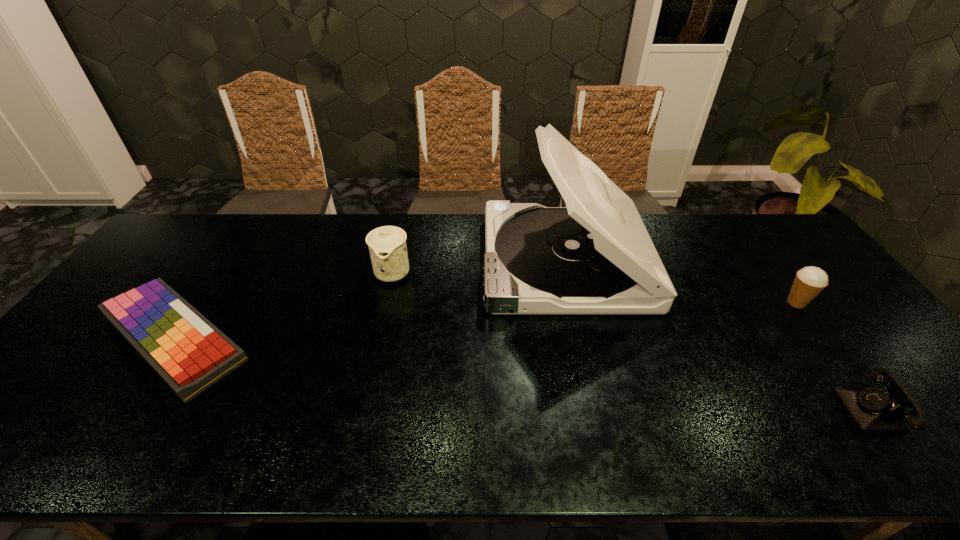
Where is `blank area in the image that satisfies the following two spatial constraints: 1. on the spout of the second tallest object; 2. on the left side of the icecream`? The width and height of the screenshot is (960, 540). blank area in the image that satisfies the following two spatial constraints: 1. on the spout of the second tallest object; 2. on the left side of the icecream is located at coordinates (386, 303).

Find the location of a particular element. free space in the image that satisfies the following two spatial constraints: 1. on the spout of the icecream; 2. on the left side of the chinaware is located at coordinates (386, 303).

This screenshot has height=540, width=960. I want to click on vacant region that satisfies the following two spatial constraints: 1. on the control panel of the tallest object; 2. on the spout of the chinaware, so click(567, 272).